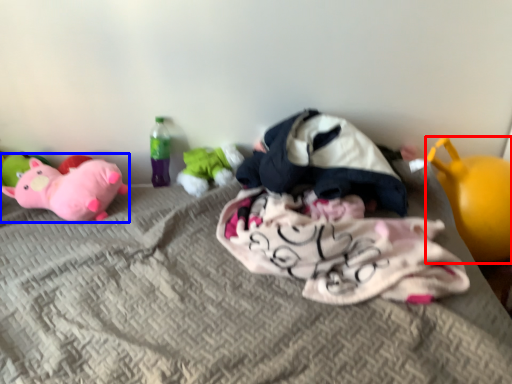
Question: Which point is further to the camera, toy (highlighted by a red box) or toy (highlighted by a blue box)?

Choices:
 (A) toy
 (B) toy

Answer: (B)